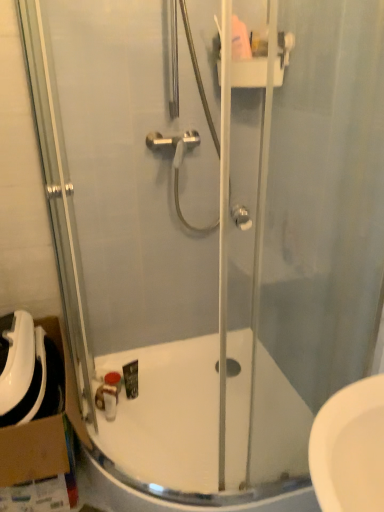
Question: Is matte brown soap at lower center surrounding cardboard at left?

Choices:
 (A) yes
 (B) no

Answer: (B)

Question: From a real-world perspective, is matte brown soap at lower center positioned over cardboard at left based on gravity?

Choices:
 (A) no
 (B) yes

Answer: (A)

Question: Considering the relative positions of matte brown soap at lower center and cardboard at left in the image provided, is matte brown soap at lower center to the left of cardboard at left from the viewer's perspective?

Choices:
 (A) no
 (B) yes

Answer: (A)

Question: Can you confirm if matte brown soap at lower center is wider than cardboard at left?

Choices:
 (A) no
 (B) yes

Answer: (A)

Question: From the image's perspective, is matte brown soap at lower center under cardboard at left?

Choices:
 (A) yes
 (B) no

Answer: (A)

Question: Considering the relative positions of matte brown soap at lower center and cardboard at left in the image provided, is matte brown soap at lower center to the right of cardboard at left from the viewer's perspective?

Choices:
 (A) yes
 (B) no

Answer: (A)

Question: From the image's perspective, is cardboard at left on matte brown soap at lower center?

Choices:
 (A) no
 (B) yes

Answer: (B)

Question: Is cardboard at left with matte brown soap at lower center?

Choices:
 (A) no
 (B) yes

Answer: (A)

Question: Does cardboard at left turn towards matte brown soap at lower center?

Choices:
 (A) no
 (B) yes

Answer: (A)

Question: Is cardboard at left smaller than matte brown soap at lower center?

Choices:
 (A) no
 (B) yes

Answer: (A)

Question: From the image's perspective, is cardboard at left beneath matte brown soap at lower center?

Choices:
 (A) yes
 (B) no

Answer: (B)

Question: Is cardboard at left surrounding matte brown soap at lower center?

Choices:
 (A) no
 (B) yes

Answer: (A)

Question: Does white glossy bath at center appear on the left side of cardboard at left?

Choices:
 (A) no
 (B) yes

Answer: (A)